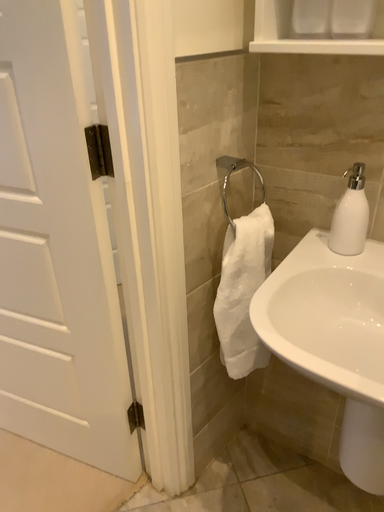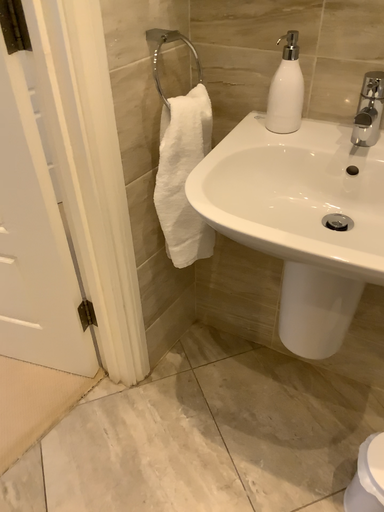
Question: Which way did the camera rotate in the video?

Choices:
 (A) rotated upward
 (B) rotated downward

Answer: (B)